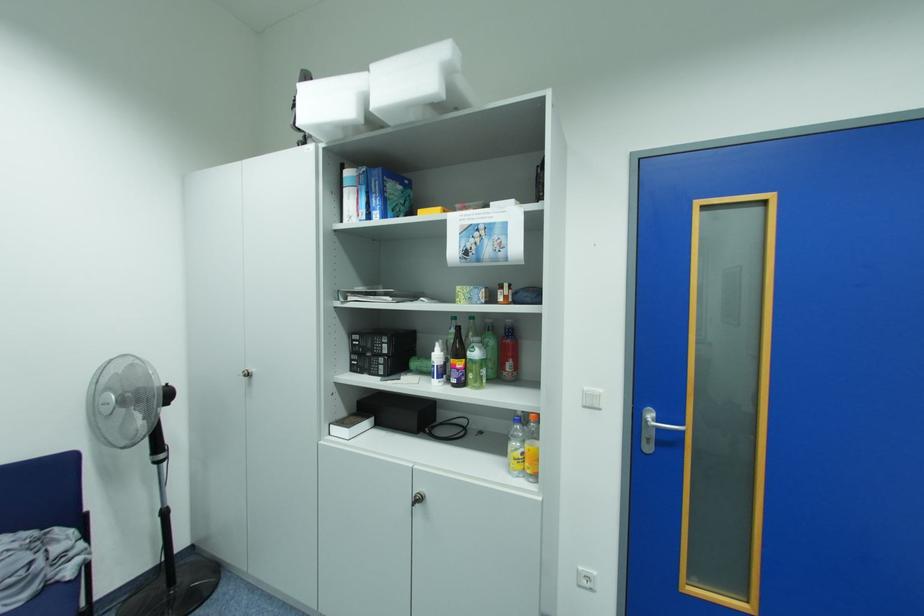
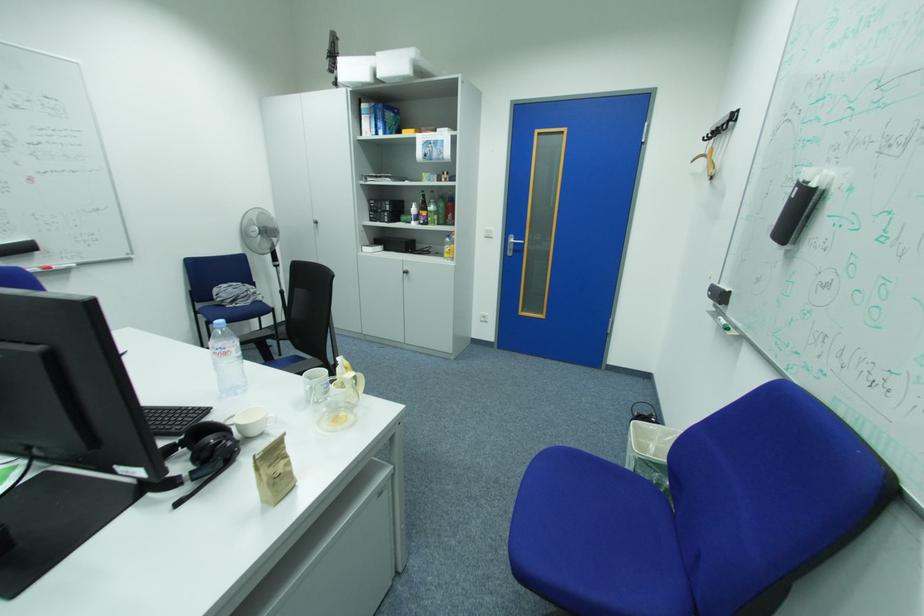
Find the pixel in the second image that matches point (658, 416) in the first image.

(520, 240)